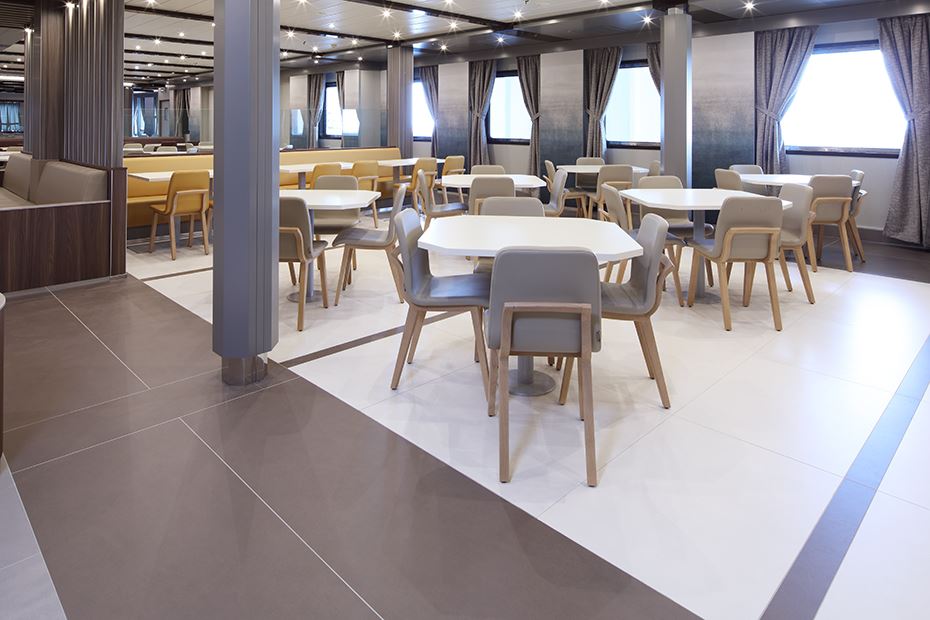
Find the location of `dark brown tiles`. dark brown tiles is located at coordinates (306, 479), (186, 507), (118, 415), (84, 355), (156, 326).